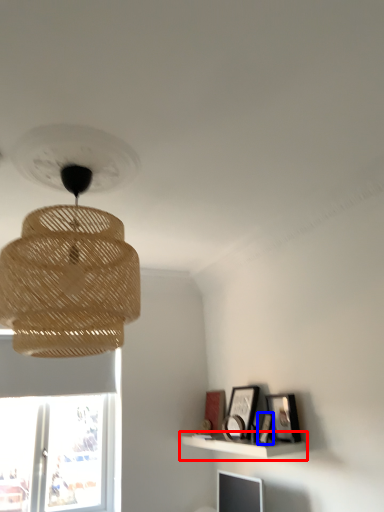
Question: Which object is further to the camera taking this photo, shelf (highlighted by a red box) or picture frame (highlighted by a blue box)?

Choices:
 (A) shelf
 (B) picture frame

Answer: (B)